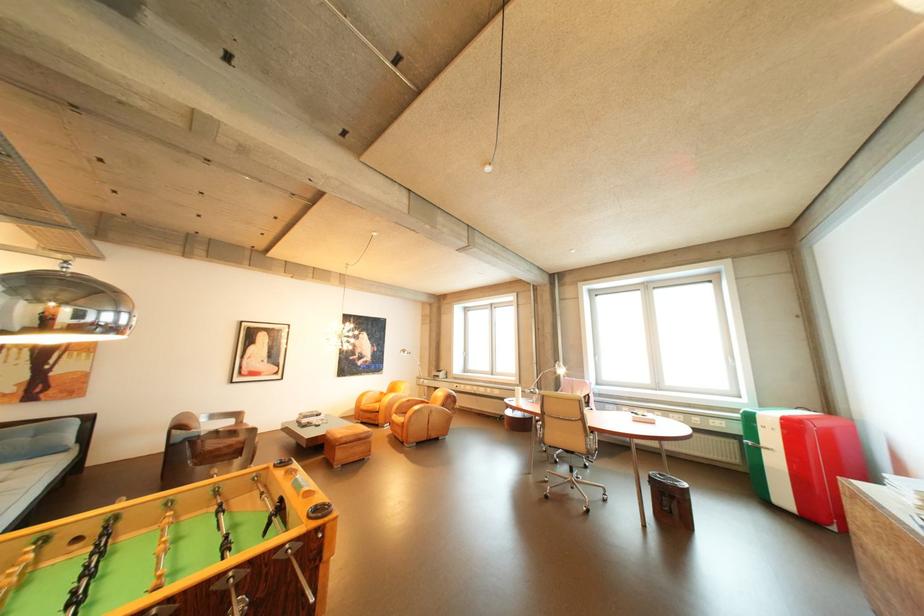
Locate an element on the screen. The height and width of the screenshot is (616, 924). orange chair sitting surface is located at coordinates (371, 406).